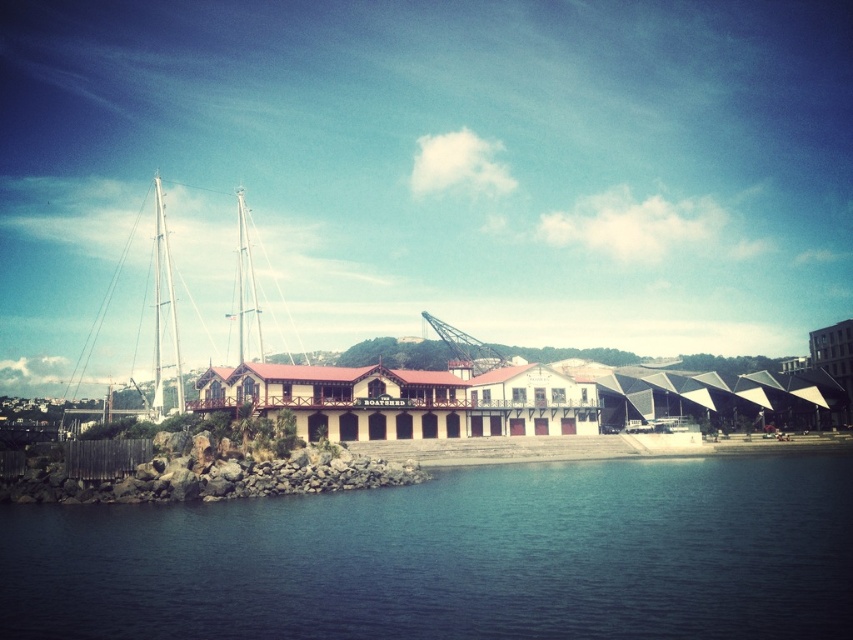
Between point (485, 612) and point (155, 356), which one is positioned behind?

Positioned behind is point (155, 356).

Is the position of blue water at lower left more distant than that of white glossy sailboat at left?

No.

Which is behind, point (259, 568) or point (97, 326)?

Point (97, 326)

Image resolution: width=853 pixels, height=640 pixels. Find the location of `blue water at lower left`. blue water at lower left is located at coordinates (456, 557).

Which of these two, blue water at lower left or white matte mast at left, stands shorter?

With less height is blue water at lower left.

What do you see at coordinates (456, 557) in the screenshot? I see `blue water at lower left` at bounding box center [456, 557].

At what (x,y) coordinates should I click in order to perform the action: click on blue water at lower left. Please return your answer as a coordinate pair (x, y). Looking at the image, I should click on (456, 557).

Can you confirm if white glossy sailboat at left is positioned above white matte mast at left?

Incorrect, white glossy sailboat at left is not positioned above white matte mast at left.

Which is behind, point (178, 412) or point (154, 177)?

Positioned behind is point (154, 177).

The height and width of the screenshot is (640, 853). What are the coordinates of `white glossy sailboat at left` in the screenshot? It's located at (163, 321).